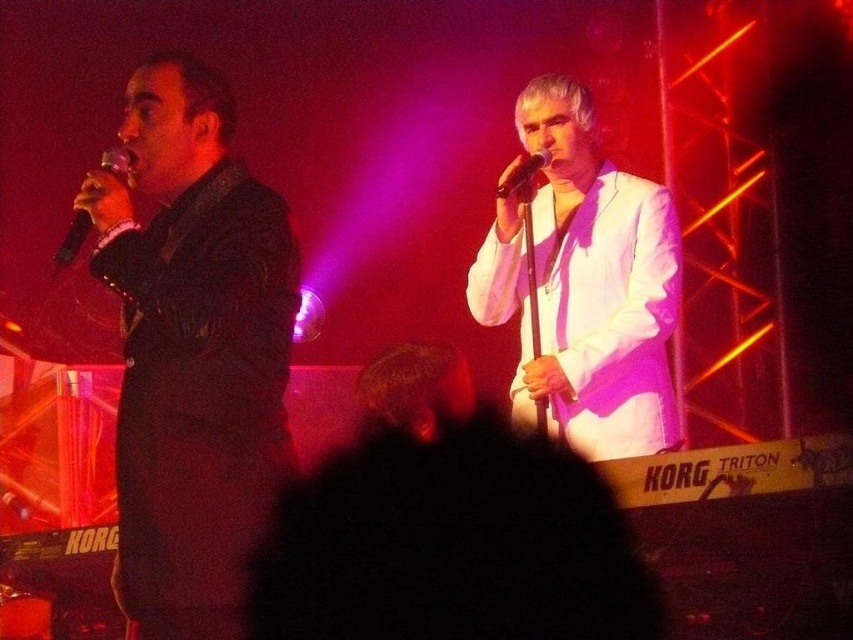
Who is shorter, matte black suit at left or black matte microphone at left?

Standing shorter between the two is black matte microphone at left.

Does matte black suit at left lie in front of black matte microphone at left?

Yes, it is in front of black matte microphone at left.

Find the location of a particular element. The image size is (853, 640). matte black suit at left is located at coordinates pyautogui.click(x=193, y=352).

Is matte black suit at left positioned behind white satin suit at center?

No.

Is point (209, 236) farther from viewer compared to point (578, 173)?

No, (209, 236) is in front of (578, 173).

Between point (202, 348) and point (611, 177), which one is positioned behind?

The point (611, 177) is behind.

At what (x,y) coordinates should I click in order to perform the action: click on matte black suit at left. Please return your answer as a coordinate pair (x, y). The image size is (853, 640). Looking at the image, I should click on (193, 352).

Describe the element at coordinates (585, 284) in the screenshot. The height and width of the screenshot is (640, 853). I see `white satin suit at center` at that location.

Between point (654, 376) and point (109, 168), which one is positioned in front?

Point (109, 168) is in front.

Who is more distant from viewer, (581,214) or (115,177)?

Point (581,214)

You are a GUI agent. You are given a task and a screenshot of the screen. Output one action in this format:
    pyautogui.click(x=<x>, y=<y>)
    Task: Click on the white satin suit at center
    This screenshot has height=640, width=853.
    Given the screenshot: What is the action you would take?
    pyautogui.click(x=585, y=284)